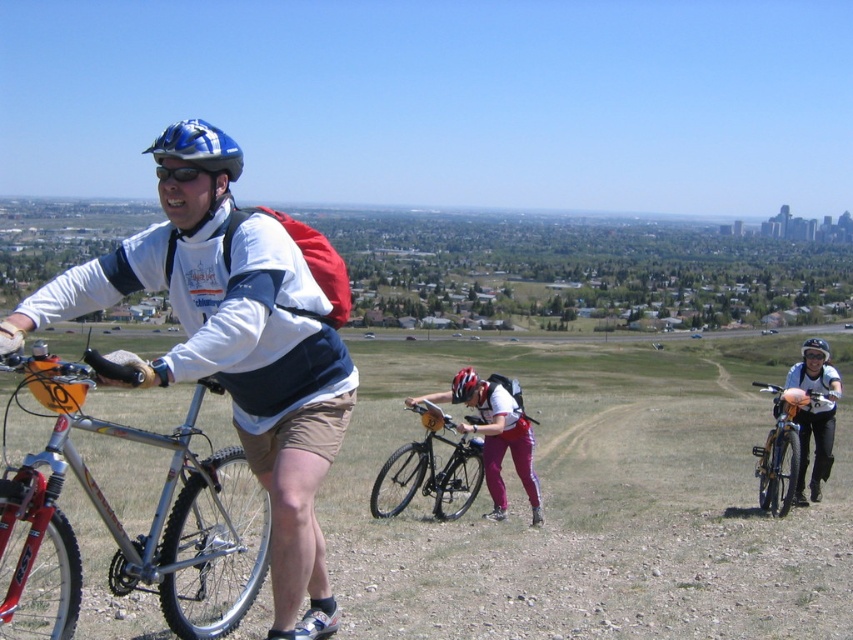
Does shiny black bicycle at center appear on the left side of matte black bicycle at right?

Yes, shiny black bicycle at center is to the left of matte black bicycle at right.

Which is behind, point (456, 477) or point (781, 483)?

Positioned behind is point (456, 477).

Is point (431, 410) more distant than point (796, 499)?

No, (431, 410) is closer to viewer.

The width and height of the screenshot is (853, 640). What are the coordinates of `shiny black bicycle at center` in the screenshot? It's located at (430, 467).

This screenshot has height=640, width=853. I want to click on silver metallic bicycle at center, so click(241, 353).

Is silver metallic bicycle at center thinner than shiny black bicycle at center?

Incorrect, silver metallic bicycle at center's width is not less than shiny black bicycle at center's.

Is point (347, 289) farther from viewer compared to point (471, 454)?

No, (347, 289) is closer to viewer.

Where is `silver metallic bicycle at center`? silver metallic bicycle at center is located at coordinates (241, 353).

Can you confirm if matte red helmet at center is wider than shiny black helmet at center?

→ In fact, matte red helmet at center might be narrower than shiny black helmet at center.

Can you confirm if matte red helmet at center is positioned above shiny black helmet at center?

Incorrect, matte red helmet at center is not positioned above shiny black helmet at center.

This screenshot has width=853, height=640. Find the location of `matte red helmet at center`. matte red helmet at center is located at coordinates (463, 385).